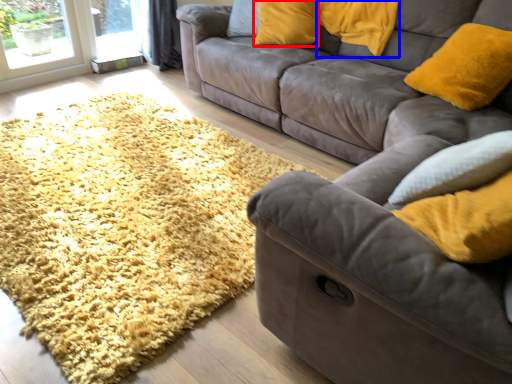
Question: Which object is further to the camera taking this photo, pillow (highlighted by a red box) or pillow (highlighted by a blue box)?

Choices:
 (A) pillow
 (B) pillow

Answer: (A)